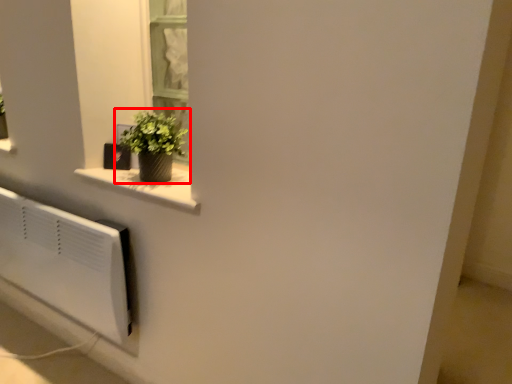
Question: In this image, where is houseplant (annotated by the red box) located relative to window sill?

Choices:
 (A) left
 (B) right

Answer: (A)